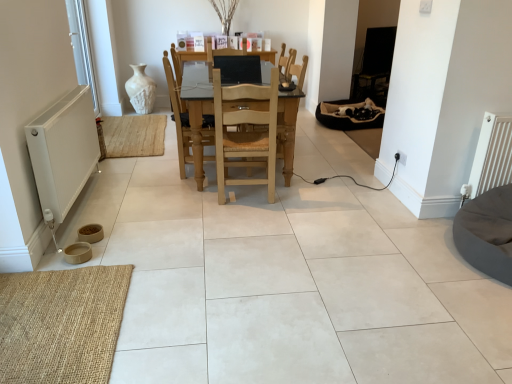
Question: Considering the relative sizes of natural wood/rattan chair at center, placed as the first chair when sorted from right to left, and soft black fabric bean bag at center right, which appears as the 2th bean bag chair when ordered from the bottom, in the image provided, is natural wood/rattan chair at center, placed as the first chair when sorted from right to left, bigger than soft black fabric bean bag at center right, which appears as the 2th bean bag chair when ordered from the bottom,?

Choices:
 (A) no
 (B) yes

Answer: (B)

Question: Would you say natural wood/rattan chair at center, the 2th chair when ordered from left to right, is outside soft black fabric bean bag at center right, which appears as the 2th bean bag chair when ordered from the bottom?

Choices:
 (A) yes
 (B) no

Answer: (A)

Question: Does natural wood/rattan chair at center, the 2th chair when ordered from left to right, have a greater width compared to soft black fabric bean bag at center right, the 1th bean bag chair from the back?

Choices:
 (A) no
 (B) yes

Answer: (A)

Question: Is natural wood/rattan chair at center, the 2th chair when ordered from left to right, next to soft black fabric bean bag at center right, the 1th bean bag chair from the back, and touching it?

Choices:
 (A) yes
 (B) no

Answer: (B)

Question: From the image's perspective, is natural wood/rattan chair at center, the 2th chair when ordered from left to right, on soft black fabric bean bag at center right, the 1th bean bag chair from the back?

Choices:
 (A) no
 (B) yes

Answer: (A)

Question: In the image, is light wood chair at center, the second chair viewed from the right, positioned in front of or behind soft black fabric bean bag at center right, the first bean bag chair viewed from the top?

Choices:
 (A) behind
 (B) front

Answer: (B)

Question: Is light wood chair at center, the second chair viewed from the right, inside or outside of soft black fabric bean bag at center right, the 1th bean bag chair from the back?

Choices:
 (A) inside
 (B) outside

Answer: (B)

Question: Visually, is light wood chair at center, the second chair viewed from the right, positioned to the left or to the right of soft black fabric bean bag at center right, the 1th bean bag chair from the back?

Choices:
 (A) left
 (B) right

Answer: (A)

Question: From a real-world perspective, relative to soft black fabric bean bag at center right, which appears as the 2th bean bag chair when ordered from the bottom, is light wood chair at center, the second chair viewed from the right, vertically above or below?

Choices:
 (A) below
 (B) above

Answer: (B)

Question: Is light wood chair at center, the first chair when ordered from left to right, taller or shorter than light wood table at center?

Choices:
 (A) tall
 (B) short

Answer: (A)

Question: Looking at their shapes, would you say light wood chair at center, the first chair when ordered from left to right, is wider or thinner than light wood table at center?

Choices:
 (A) thin
 (B) wide

Answer: (A)

Question: Does point (188, 155) appear closer or farther from the camera than point (196, 94)?

Choices:
 (A) closer
 (B) farther

Answer: (A)

Question: Is light wood chair at center, the first chair when ordered from left to right, inside or outside of light wood table at center?

Choices:
 (A) outside
 (B) inside

Answer: (B)

Question: In terms of height, does dark gray fabric bean bag at lower right, which appears as the 2th bean bag chair when viewed from the top, look taller or shorter compared to white plastic window screen at left?

Choices:
 (A) tall
 (B) short

Answer: (B)

Question: Does point (502, 259) appear closer or farther from the camera than point (74, 44)?

Choices:
 (A) closer
 (B) farther

Answer: (A)